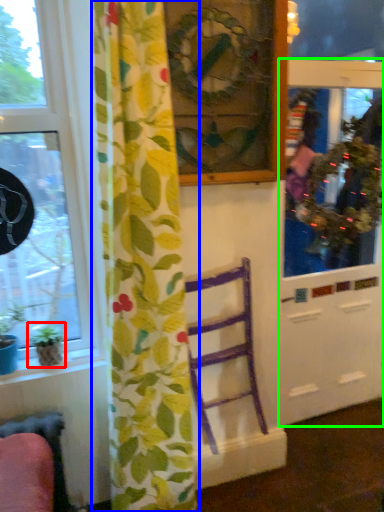
Question: Estimate the real-world distances between objects in this image. Which object is farther from houseplant (highlighted by a red box), curtain (highlighted by a blue box) or screen door (highlighted by a green box)?

Choices:
 (A) curtain
 (B) screen door

Answer: (B)